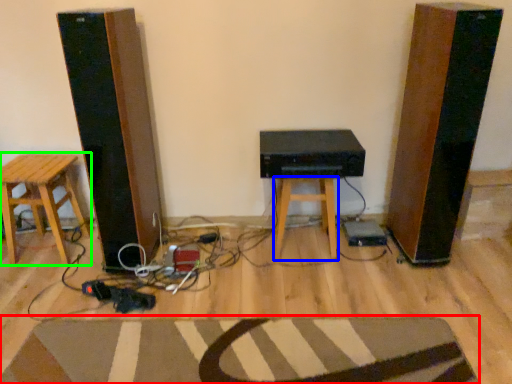
Question: Based on their relative distances, which object is nearer to doormat (highlighted by a red box)? Choose from stool (highlighted by a blue box) and stool (highlighted by a green box).

Choices:
 (A) stool
 (B) stool

Answer: (A)